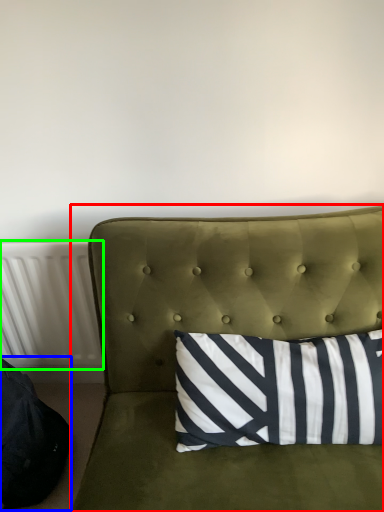
Question: Which is nearer to the studio couch (highlighted by a red box)? bean bag chair (highlighted by a blue box) or radiator (highlighted by a green box).

Choices:
 (A) bean bag chair
 (B) radiator

Answer: (B)